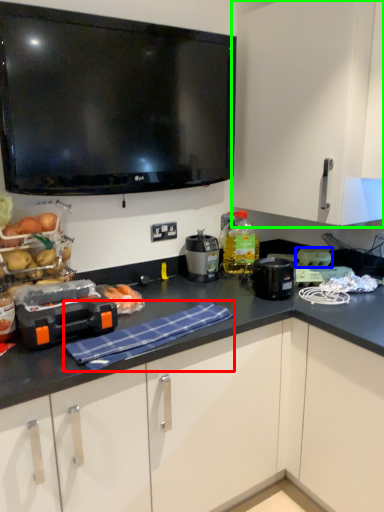
Question: Which object is positioned farthest from cloth (highlighted by a red box)? Select from appliance (highlighted by a blue box) and cabinetry (highlighted by a green box).

Choices:
 (A) appliance
 (B) cabinetry

Answer: (B)